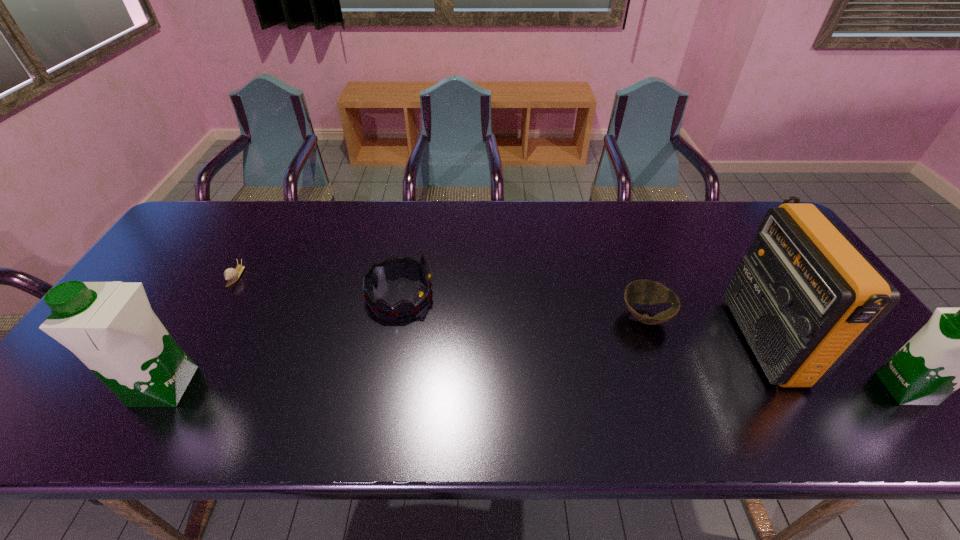
The height and width of the screenshot is (540, 960). I want to click on vacant position for inserting another soya_milk evenly, so click(535, 388).